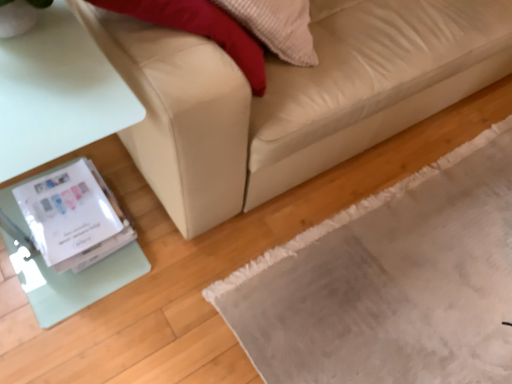
Where is `empty space that is ontop of white glossy wii at lower left (from a real-world perspective)`? The width and height of the screenshot is (512, 384). empty space that is ontop of white glossy wii at lower left (from a real-world perspective) is located at coordinates (64, 203).